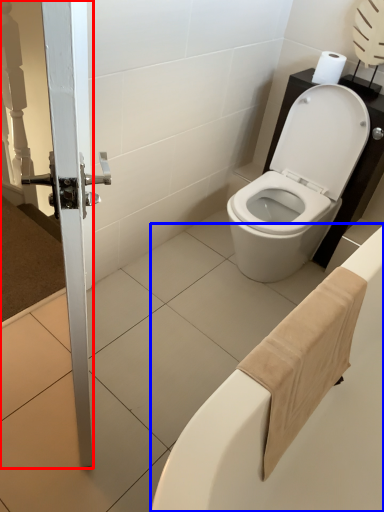
Question: Among these objects, which one is nearest to the camera, screen door (highlighted by a red box) or bath (highlighted by a blue box)?

Choices:
 (A) screen door
 (B) bath

Answer: (A)